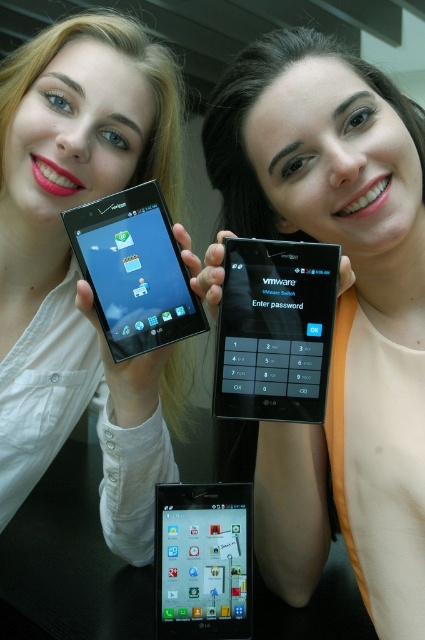
Is matte black phone at center positioned before black glossy tablet at upper left?

Yes, it is.

Between matte black phone at center and black glossy tablet at upper left, which one is positioned lower?

matte black phone at center is lower down.

Describe the element at coordinates (337, 308) in the screenshot. This screenshot has width=425, height=640. I see `matte black phone at center` at that location.

Locate an element on the screen. Image resolution: width=425 pixels, height=640 pixels. matte black phone at center is located at coordinates [x=337, y=308].

Which is behind, point (255, 86) or point (59, 68)?

Positioned behind is point (59, 68).

Can you confirm if matte black phone at center is positioned to the right of matte black phone at upper left?

Indeed, matte black phone at center is positioned on the right side of matte black phone at upper left.

Measure the distance between point (x=356, y=426) and camera.

A distance of 69.73 centimeters exists between point (x=356, y=426) and camera.

You are a GUI agent. You are given a task and a screenshot of the screen. Output one action in this format:
    pyautogui.click(x=<x>, y=<y>)
    Task: Click on the matte black phone at center
    The image size is (425, 640).
    Given the screenshot: What is the action you would take?
    pyautogui.click(x=337, y=308)

Is matte black phone at center taller than black glossy tablet at center?

Yes.

Which is more to the right, matte black phone at center or black glossy tablet at center?

Positioned to the right is matte black phone at center.

The width and height of the screenshot is (425, 640). I want to click on matte black phone at center, so click(337, 308).

Find the location of a particular element. The height and width of the screenshot is (640, 425). matte black phone at center is located at coordinates (337, 308).